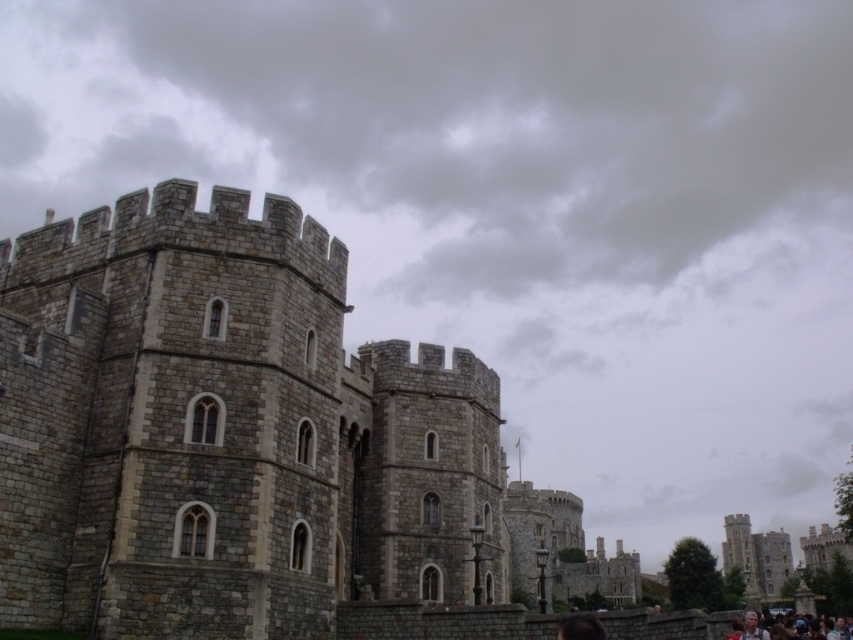
Question: Which point is closer to the camera?

Choices:
 (A) (746, 625)
 (B) (335, 372)

Answer: (A)

Question: Does stone castle at center have a lesser width compared to light brown hair at lower right?

Choices:
 (A) yes
 (B) no

Answer: (B)

Question: Does stone castle at center have a smaller size compared to light brown hair at lower right?

Choices:
 (A) yes
 (B) no

Answer: (B)

Question: Which object appears closest to the camera in this image?

Choices:
 (A) light brown hair at lower right
 (B) stone castle at center

Answer: (B)

Question: Is stone castle at center thinner than light brown hair at lower right?

Choices:
 (A) no
 (B) yes

Answer: (A)

Question: Which of the following is the farthest from the observer?

Choices:
 (A) (766, 627)
 (B) (332, 490)

Answer: (A)